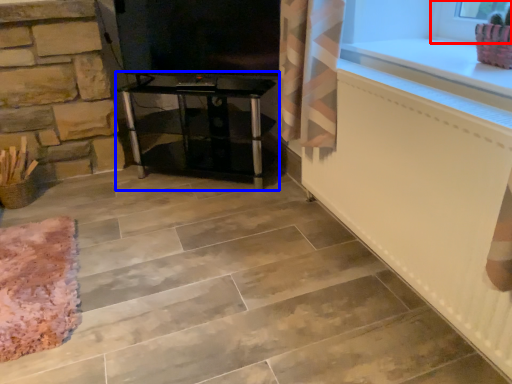
Question: Which of the following is the closest to the observer, window frame (highlighted by a red box) or furniture (highlighted by a blue box)?

Choices:
 (A) window frame
 (B) furniture

Answer: (A)